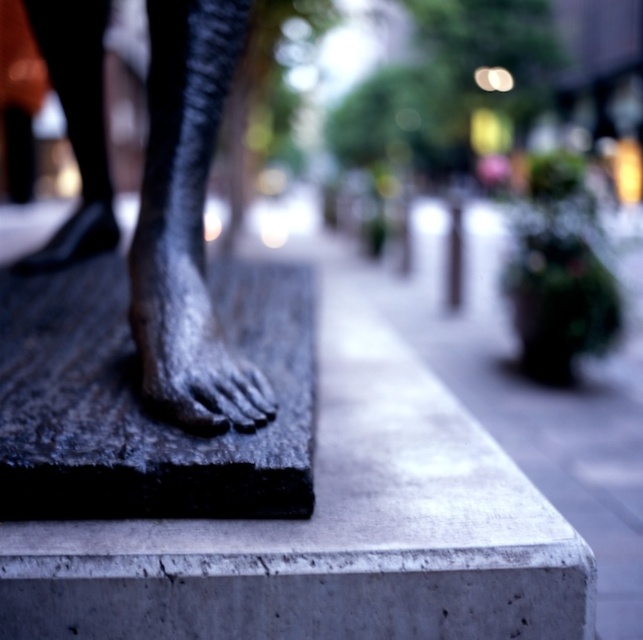
Is bronze statue foot at center taller than black granite slab at center?

No.

Between point (249, 417) and point (399, 320), which one is positioned in front?

Point (249, 417) is in front.

I want to click on bronze statue foot at center, so click(186, 221).